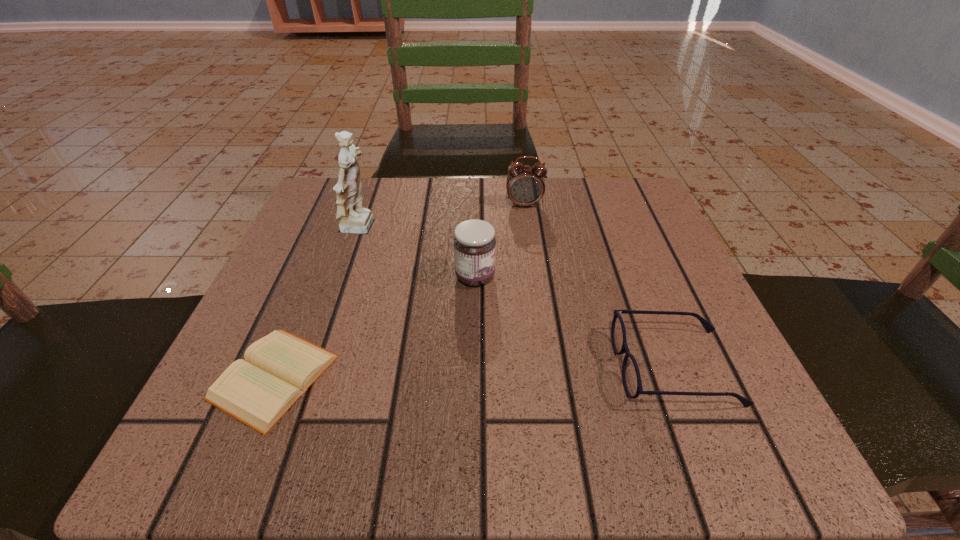
At what (x,y) coordinates should I click in order to perform the action: click on figurine that is at the left edge. Please return your answer as a coordinate pair (x, y). The image size is (960, 540). Looking at the image, I should click on (353, 218).

You are a GUI agent. You are given a task and a screenshot of the screen. Output one action in this format:
    pyautogui.click(x=<x>, y=<y>)
    Task: Click on the diary present at the left edge
    
    Given the screenshot: What is the action you would take?
    pyautogui.click(x=279, y=368)

At what (x,y) coordinates should I click in order to perform the action: click on object that is at the right edge. Please return your answer as a coordinate pair (x, y). This screenshot has height=540, width=960. Looking at the image, I should click on (631, 378).

What are the coordinates of `object located at the far left corner` in the screenshot? It's located at (353, 218).

This screenshot has height=540, width=960. I want to click on object that is at the near left corner, so click(x=279, y=368).

I want to click on object that is at the near right corner, so click(x=631, y=378).

At what (x,y) coordinates should I click in order to perform the action: click on free space at the far edge. Please return your answer as a coordinate pair (x, y). The height and width of the screenshot is (540, 960). Looking at the image, I should click on (395, 217).

The height and width of the screenshot is (540, 960). Find the location of `vacant space at the near edge of the desktop`. vacant space at the near edge of the desktop is located at coordinates (338, 438).

The width and height of the screenshot is (960, 540). In order to click on vacant point at the left edge in this screenshot , I will do `click(296, 320)`.

Identify the location of free region at the right edge. The height and width of the screenshot is (540, 960). (614, 302).